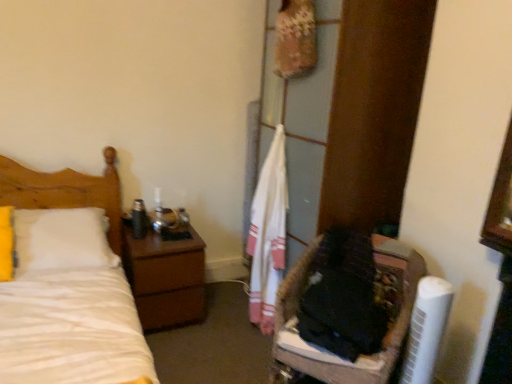
Locate an element on the screen. vacant area that is in front of white cotton towel at center is located at coordinates (244, 349).